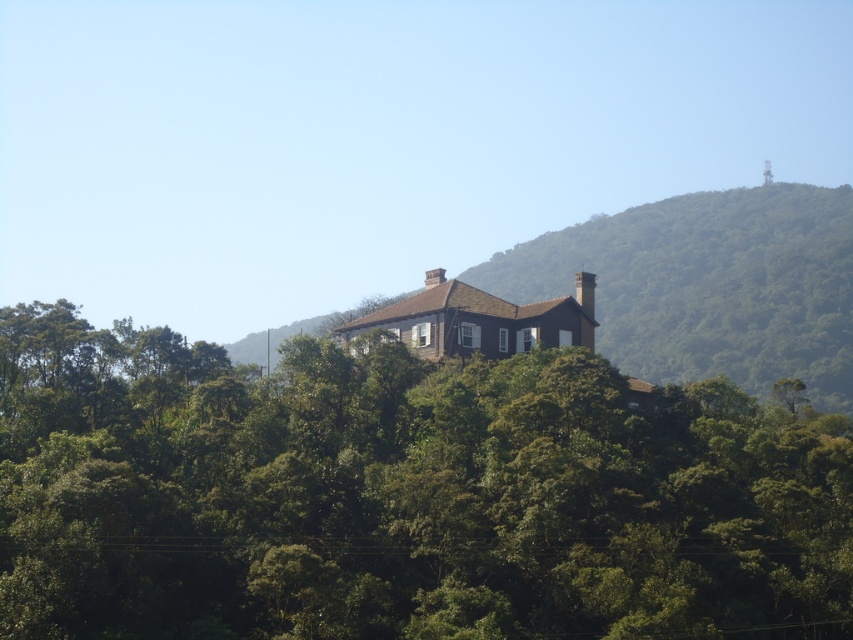
This screenshot has height=640, width=853. What do you see at coordinates (401, 496) in the screenshot?
I see `green leafy tree at center` at bounding box center [401, 496].

The image size is (853, 640). What do you see at coordinates (401, 496) in the screenshot?
I see `green leafy tree at center` at bounding box center [401, 496].

Identify the location of green leafy tree at center. This screenshot has height=640, width=853. (401, 496).